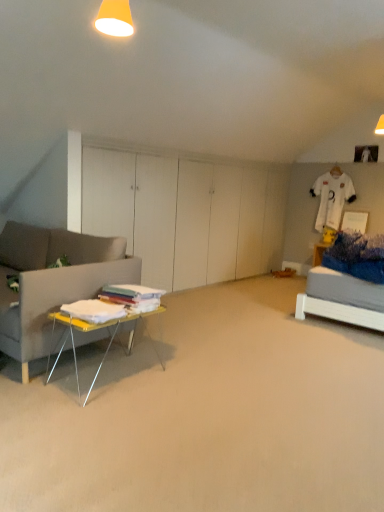
Question: Considering the positions of yellow matte lampshade at upper center and white fabric at left in the image, is yellow matte lampshade at upper center wider or thinner than white fabric at left?

Choices:
 (A) thin
 (B) wide

Answer: (A)

Question: Is yellow matte lampshade at upper center taller or shorter than white fabric at left?

Choices:
 (A) tall
 (B) short

Answer: (A)

Question: Estimate the real-world distances between objects in this image. Which object is closer to the yellow metallic table at lower left?

Choices:
 (A) white fabric at left
 (B) yellow matte lampshade at upper center

Answer: (A)

Question: Which object is the closest to the yellow matte lampshade at upper center?

Choices:
 (A) white fabric at left
 (B) yellow metallic table at lower left

Answer: (B)